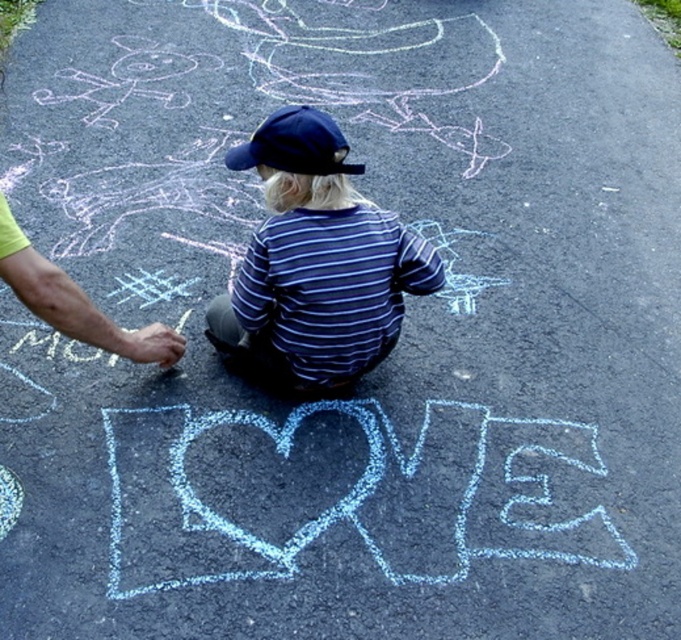
Question: Is blue striped shirt at center bigger than navy blue fabric baseball cap at center?

Choices:
 (A) yes
 (B) no

Answer: (A)

Question: Which object is farther from the camera taking this photo?

Choices:
 (A) blue striped shirt at center
 (B) navy blue fabric baseball cap at center

Answer: (B)

Question: From the image, what is the correct spatial relationship of blue striped shirt at center in relation to navy blue fabric baseball cap at center?

Choices:
 (A) right
 (B) left

Answer: (B)

Question: Which point is closer to the camera?

Choices:
 (A) (321, 332)
 (B) (247, 157)

Answer: (B)

Question: Can you confirm if blue striped shirt at center is bigger than navy blue fabric baseball cap at center?

Choices:
 (A) yes
 (B) no

Answer: (A)

Question: Among these points, which one is farthest from the camera?

Choices:
 (A) (249, 168)
 (B) (360, 337)

Answer: (B)